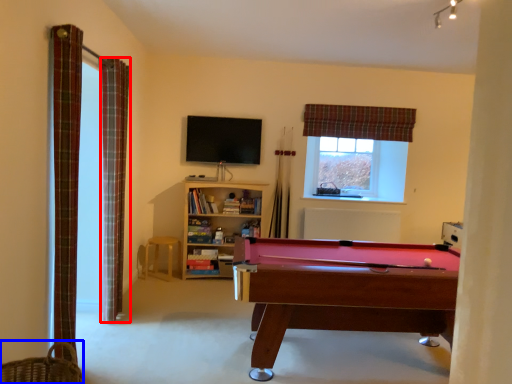
Question: Which object appears farthest to the camera in this image, curtain (highlighted by a red box) or basket (highlighted by a blue box)?

Choices:
 (A) curtain
 (B) basket

Answer: (A)